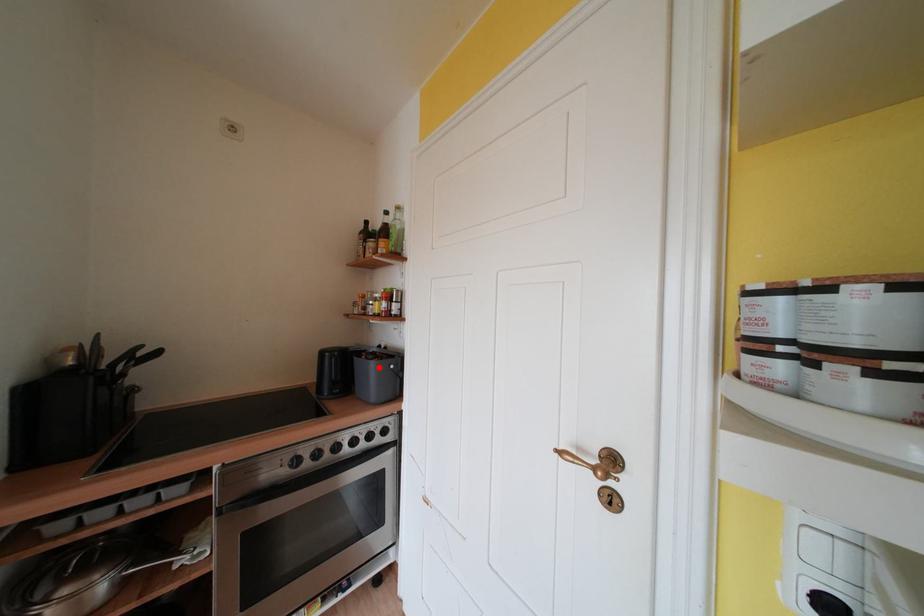
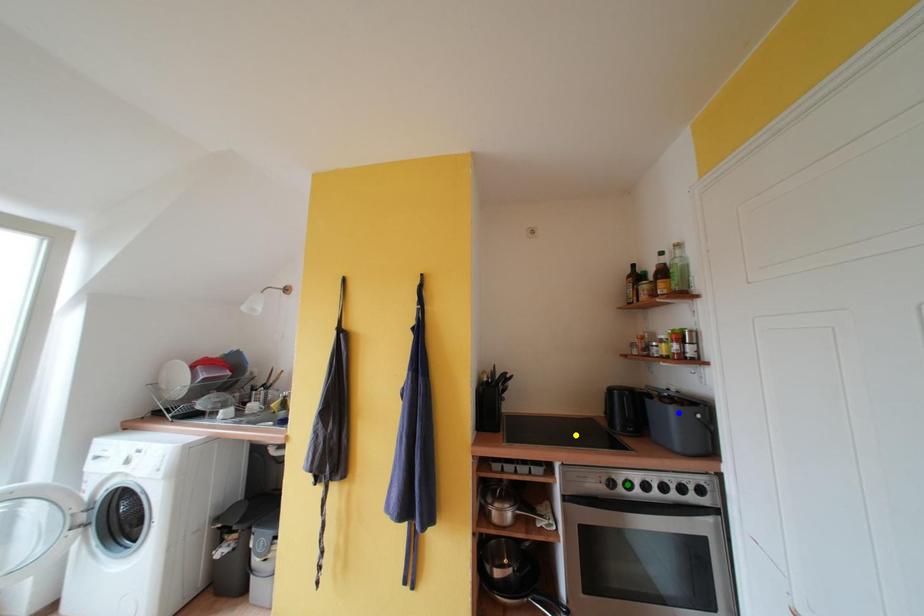
Question: I am providing you with two images of the same scene from different viewpoints. A red point is marked on the first image. You are given multiple points on the second image. Which point in image 2 represents the same 3d spot as the red point in image 1?

Choices:
 (A) green point
 (B) yellow point
 (C) blue point

Answer: (C)